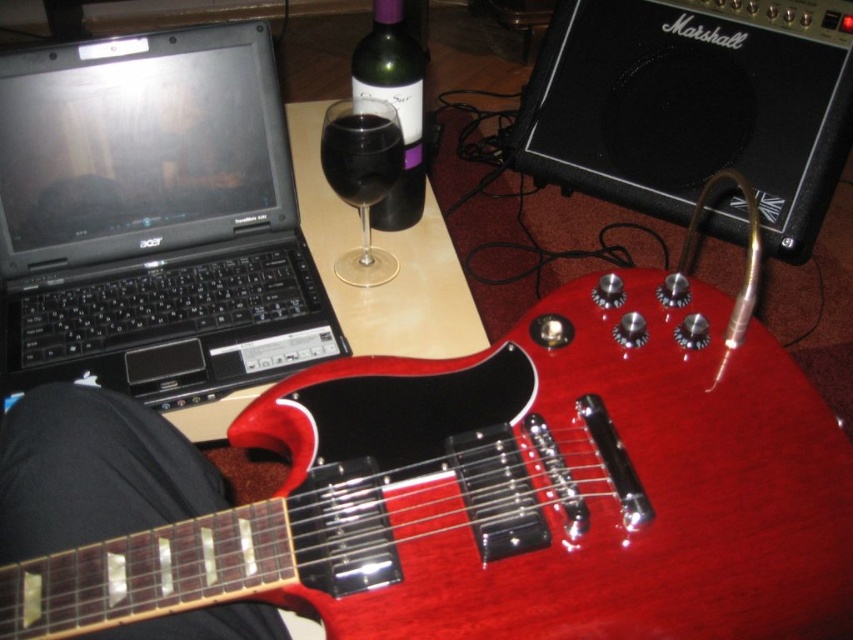
Where is `black matte laptop at upper left`? Image resolution: width=853 pixels, height=640 pixels. black matte laptop at upper left is located at coordinates (152, 220).

Is the position of black matte laptop at upper left more distant than that of green glass bottle at center?

No, black matte laptop at upper left is in front of green glass bottle at center.

Does point (265, 125) come behind point (384, 81)?

That is True.

This screenshot has width=853, height=640. What are the coordinates of `black matte laptop at upper left` in the screenshot? It's located at (152, 220).

Consider the image. Who is positioned more to the left, glossy wood guitar at center or green glass bottle at center?

green glass bottle at center is more to the left.

Is glossy wood guitar at center to the left of green glass bottle at center from the viewer's perspective?

No, glossy wood guitar at center is not to the left of green glass bottle at center.

This screenshot has height=640, width=853. In order to click on glossy wood guitar at center in this screenshot , I will do `click(515, 492)`.

In the scene shown: Between glossy wood guitar at center and black matte laptop at upper left, which one is positioned lower?

glossy wood guitar at center

Can you confirm if glossy wood guitar at center is wider than black matte laptop at upper left?

Indeed, glossy wood guitar at center has a greater width compared to black matte laptop at upper left.

Is point (409, 545) less distant than point (126, 289)?

Yes, point (409, 545) is closer to viewer.

Image resolution: width=853 pixels, height=640 pixels. What are the coordinates of `glossy wood guitar at center` in the screenshot? It's located at (515, 492).